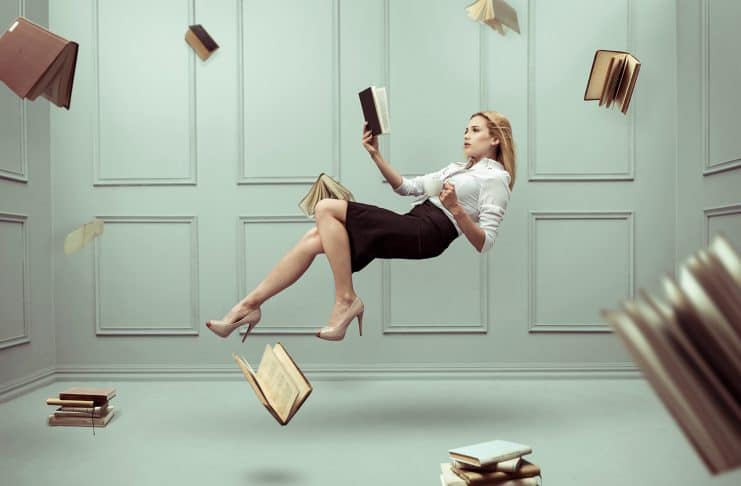
In order to click on white book cover in this screenshot , I will do `click(488, 449)`.